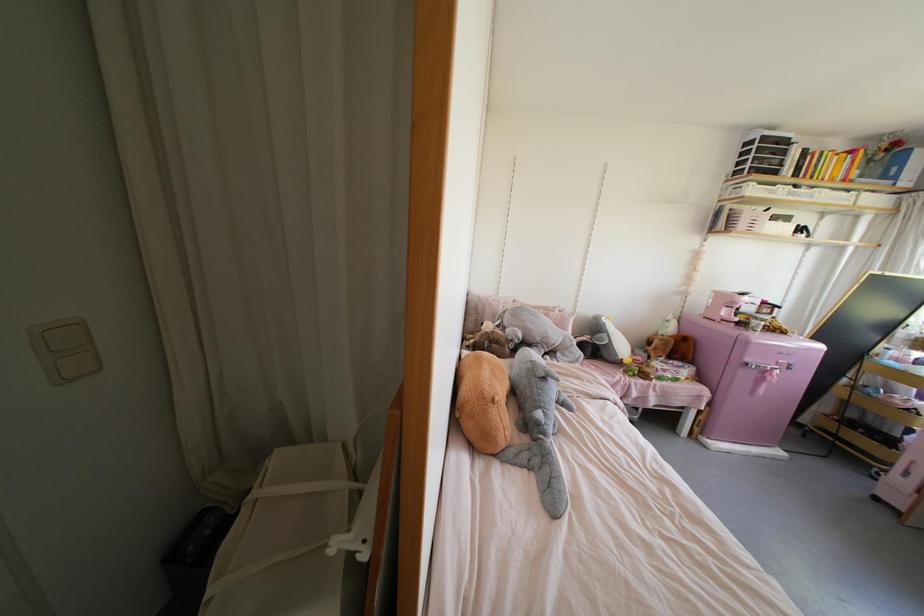
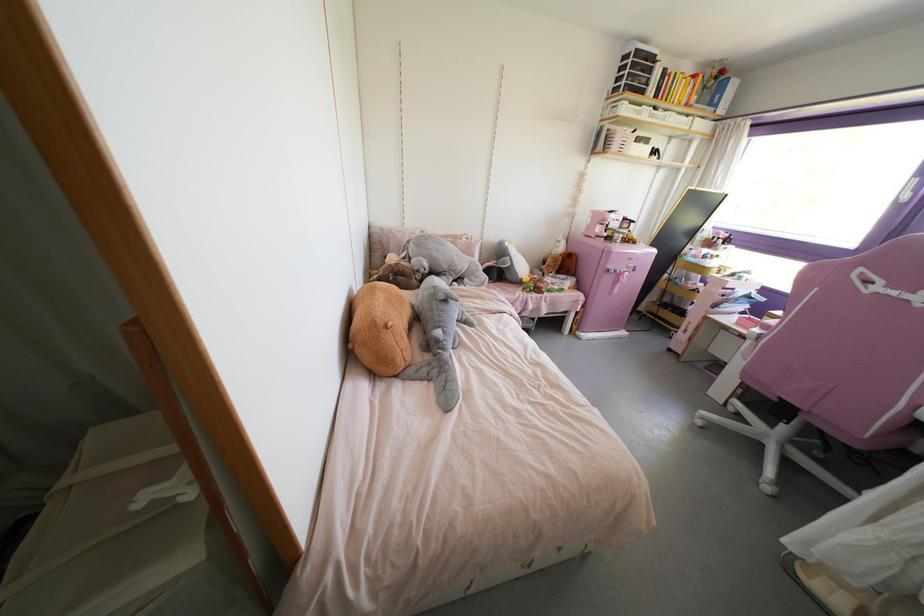
The point at (495, 398) is marked in the first image. Where is the corresponding point in the second image?

(390, 323)